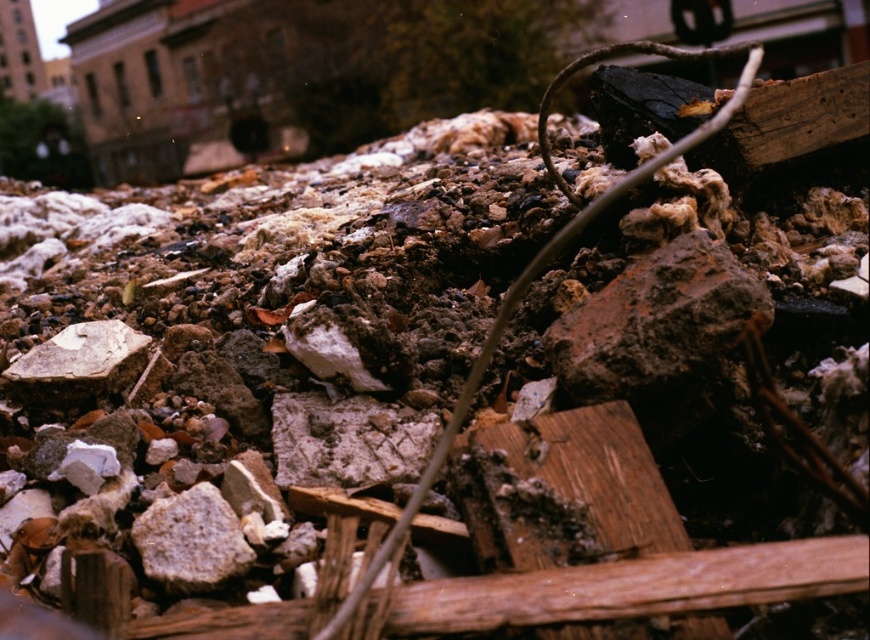
You are a drone operator trying to map a debris field. You have two points marked in the debris field at coordinates point (577, 355) and point (177, 550). Which point is closer to the camera?

Point (177, 550) is closer to the camera than point (577, 355).